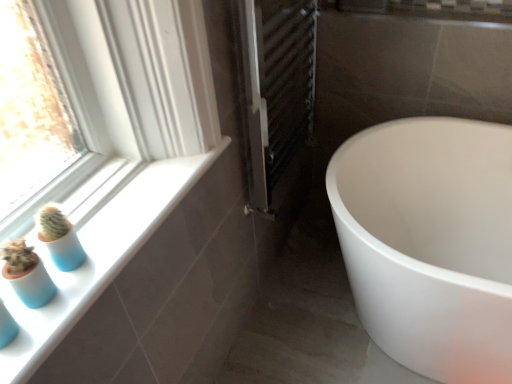
Question: From the image's perspective, is metallic silver radiator at center above white glossy tub at lower right?

Choices:
 (A) yes
 (B) no

Answer: (A)

Question: Would you consider metallic silver radiator at center to be distant from white glossy tub at lower right?

Choices:
 (A) no
 (B) yes

Answer: (A)

Question: Considering the relative sizes of metallic silver radiator at center and white glossy tub at lower right in the image provided, is metallic silver radiator at center smaller than white glossy tub at lower right?

Choices:
 (A) yes
 (B) no

Answer: (A)

Question: Is metallic silver radiator at center completely or partially outside of white glossy tub at lower right?

Choices:
 (A) yes
 (B) no

Answer: (A)

Question: Is metallic silver radiator at center at the right side of white glossy tub at lower right?

Choices:
 (A) yes
 (B) no

Answer: (B)

Question: Does metallic silver radiator at center have a lesser width compared to white glossy tub at lower right?

Choices:
 (A) yes
 (B) no

Answer: (A)

Question: Would you say white glossy window sill at lower left contains metallic silver radiator at center?

Choices:
 (A) yes
 (B) no

Answer: (B)

Question: Considering the relative positions of white glossy window sill at lower left and metallic silver radiator at center in the image provided, is white glossy window sill at lower left behind metallic silver radiator at center?

Choices:
 (A) yes
 (B) no

Answer: (B)

Question: Does white glossy window sill at lower left have a lesser width compared to metallic silver radiator at center?

Choices:
 (A) yes
 (B) no

Answer: (B)

Question: Does white glossy window sill at lower left turn towards metallic silver radiator at center?

Choices:
 (A) no
 (B) yes

Answer: (A)

Question: Is the position of white glossy window sill at lower left less distant than that of metallic silver radiator at center?

Choices:
 (A) no
 (B) yes

Answer: (B)

Question: Is there a large distance between white glossy window sill at lower left and metallic silver radiator at center?

Choices:
 (A) yes
 (B) no

Answer: (B)

Question: From the image's perspective, is white glossy tub at lower right above blue matte glass vase at lower left?

Choices:
 (A) no
 (B) yes

Answer: (A)